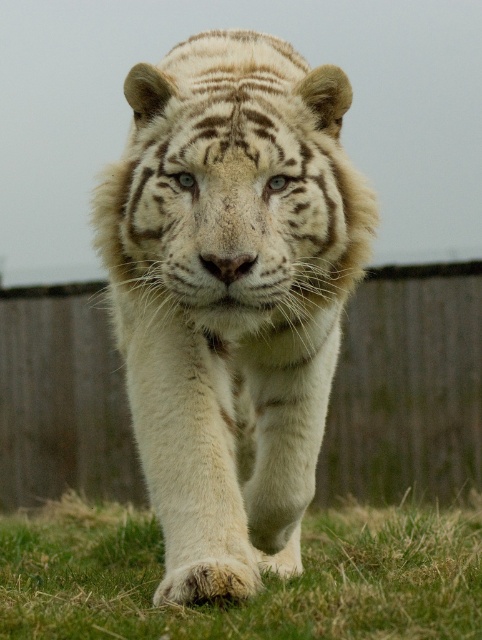
Question: Which of the following is the closest to the observer?

Choices:
 (A) wooden fence at center
 (B) white fur tiger at center
 (C) green grass at lower center

Answer: (B)

Question: Does wooden fence at center have a lesser width compared to green grass at lower center?

Choices:
 (A) no
 (B) yes

Answer: (A)

Question: Is white fur tiger at center thinner than wooden fence at center?

Choices:
 (A) no
 (B) yes

Answer: (B)

Question: Which point appears closest to the camera in this image?

Choices:
 (A) (25, 614)
 (B) (232, 156)
 (C) (386, 486)

Answer: (B)

Question: Does wooden fence at center have a lesser width compared to green grass at lower center?

Choices:
 (A) yes
 (B) no

Answer: (B)

Question: Which point is closer to the camera?

Choices:
 (A) white fur tiger at center
 (B) wooden fence at center
 (C) green grass at lower center

Answer: (A)